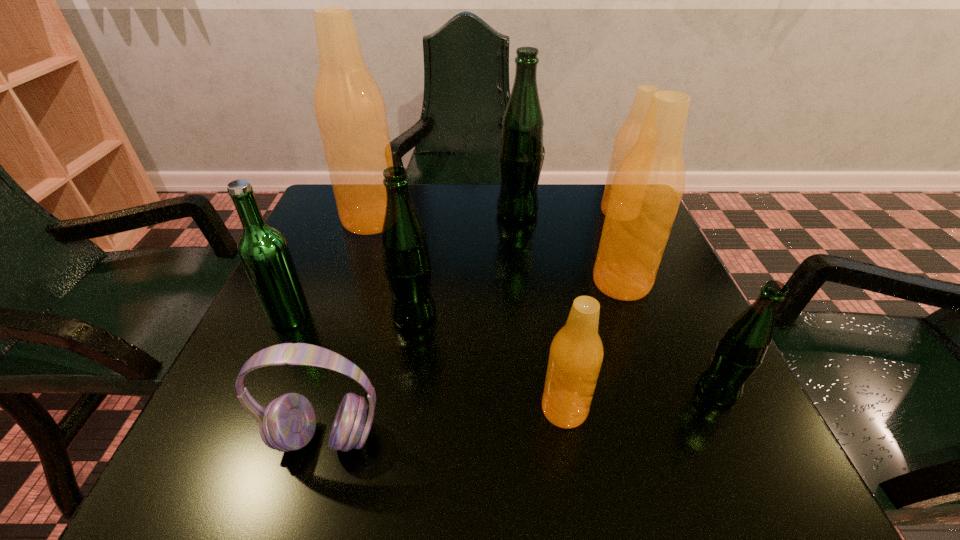
At what (x,y) coordinates should I click in order to perform the action: click on vacant space located on the back of the smallest tan beer bottle. Please return your answer as a coordinate pair (x, y). Looking at the image, I should click on (538, 244).

Locate an element on the screen. The image size is (960, 540). beer bottle that is at the near edge is located at coordinates (576, 354).

Image resolution: width=960 pixels, height=540 pixels. I want to click on headset that is positioned at the near edge, so click(x=288, y=423).

Find the location of a particular element. This screenshot has width=960, height=540. headset positioned at the left edge is located at coordinates (288, 423).

This screenshot has width=960, height=540. Find the location of `object that is at the far left corner`. object that is at the far left corner is located at coordinates (349, 108).

I want to click on object that is at the near left corner, so click(288, 423).

Where is `object situated at the far right corner`? object situated at the far right corner is located at coordinates (627, 134).

This screenshot has height=540, width=960. Identify the location of vacant space at the far edge of the desktop. (557, 231).

The image size is (960, 540). Identify the location of free region at the near edge. (334, 450).

Identify the location of vacant space at the left edge of the desktop. Image resolution: width=960 pixels, height=540 pixels. (325, 247).